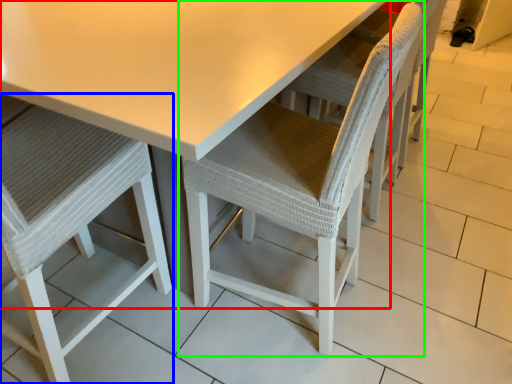
Question: Which is nearer to the table (highlighted by a red box)? chair (highlighted by a blue box) or chair (highlighted by a green box).

Choices:
 (A) chair
 (B) chair

Answer: (B)